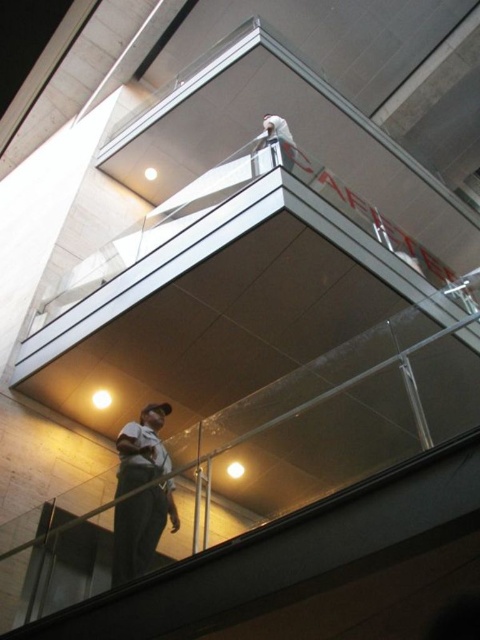
Question: Considering the relative positions of white fabric shirt at lower center and white matte helmet at upper center in the image provided, where is white fabric shirt at lower center located with respect to white matte helmet at upper center?

Choices:
 (A) left
 (B) right

Answer: (A)

Question: Is white fabric shirt at lower center to the left of white matte helmet at upper center from the viewer's perspective?

Choices:
 (A) yes
 (B) no

Answer: (A)

Question: Does white fabric shirt at lower center have a smaller size compared to white matte helmet at upper center?

Choices:
 (A) no
 (B) yes

Answer: (A)

Question: Which point is closer to the camera taking this photo?

Choices:
 (A) (292, 141)
 (B) (126, 428)

Answer: (B)